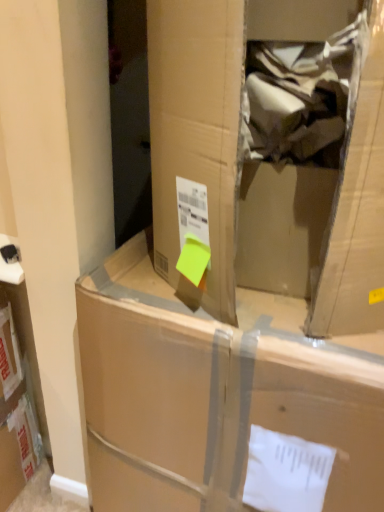
Question: Would you say cardboard box at center is part of brown cardboard box at center's contents?

Choices:
 (A) yes
 (B) no

Answer: (B)

Question: Is the position of brown cardboard box at center more distant than that of cardboard box at center?

Choices:
 (A) no
 (B) yes

Answer: (A)

Question: Is brown cardboard box at center next to cardboard box at center and touching it?

Choices:
 (A) no
 (B) yes

Answer: (A)

Question: Can you confirm if brown cardboard box at center is positioned to the left of cardboard box at center?

Choices:
 (A) no
 (B) yes

Answer: (A)

Question: Does brown cardboard box at center have a lesser width compared to cardboard box at center?

Choices:
 (A) no
 (B) yes

Answer: (B)

Question: From a real-world perspective, does brown cardboard box at center stand above cardboard box at center?

Choices:
 (A) no
 (B) yes

Answer: (B)

Question: Is cardboard box at center positioned beyond the bounds of brown cardboard box at center?

Choices:
 (A) no
 (B) yes

Answer: (B)

Question: From a real-world perspective, is cardboard box at center on top of brown cardboard box at center?

Choices:
 (A) no
 (B) yes

Answer: (A)

Question: Considering the relative sizes of cardboard box at center and brown cardboard box at center in the image provided, is cardboard box at center bigger than brown cardboard box at center?

Choices:
 (A) no
 (B) yes

Answer: (B)

Question: Does cardboard box at center have a greater width compared to brown cardboard box at center?

Choices:
 (A) yes
 (B) no

Answer: (A)

Question: Is cardboard box at center next to brown cardboard box at center?

Choices:
 (A) yes
 (B) no

Answer: (B)

Question: Considering the relative sizes of cardboard box at center and brown cardboard box at center in the image provided, is cardboard box at center shorter than brown cardboard box at center?

Choices:
 (A) yes
 (B) no

Answer: (B)

Question: From a real-world perspective, is cardboard box at center above or below brown cardboard box at center?

Choices:
 (A) below
 (B) above

Answer: (A)